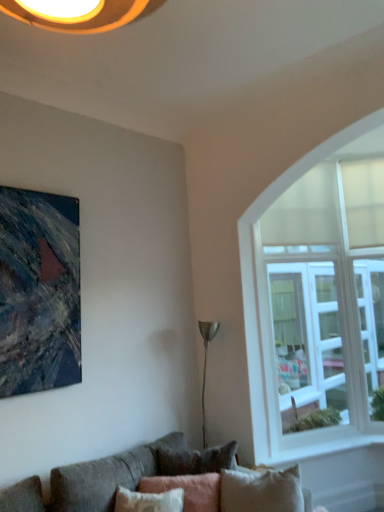
You are a GUI agent. You are given a task and a screenshot of the screen. Output one action in this format:
    pyautogui.click(x=<x>, y=<y>)
    Task: Click on the textured canvas painting at upper left
    Image resolution: width=384 pixels, height=512 pixels.
    Given the screenshot: What is the action you would take?
    pyautogui.click(x=39, y=292)

From the image's perspective, between white glass window at right and textured gray couch at lower left, which one is located above?

white glass window at right, from the image's perspective.

Is white glass window at right inside the boundaries of textured gray couch at lower left, or outside?

white glass window at right is not enclosed by textured gray couch at lower left.

Consider the image. Between white glass window at right and textured gray couch at lower left, which one appears on the right side from the viewer's perspective?

Positioned to the right is white glass window at right.

Looking at this image, is white glass window at right behind textured gray couch at lower left?

That is True.

From a real-world perspective, is textured gray couch at lower left physically located above or below pink fabric pillow at lower center?

From a real-world perspective, textured gray couch at lower left is physically below pink fabric pillow at lower center.

Does point (196, 456) lie in front of point (169, 488)?

No, it is not.

Considering the relative sizes of textured gray couch at lower left and pink fabric pillow at lower center in the image provided, is textured gray couch at lower left taller than pink fabric pillow at lower center?

Correct, textured gray couch at lower left is much taller as pink fabric pillow at lower center.

Considering their positions, is textured gray couch at lower left located in front of or behind pink fabric pillow at lower center?

textured gray couch at lower left is positioned closer to the viewer than pink fabric pillow at lower center.

From the image's perspective, is pink fabric pillow at lower center beneath white glass window at right?

Yes, from the image's perspective, pink fabric pillow at lower center is below white glass window at right.

Is pink fabric pillow at lower center taller than white glass window at right?

Incorrect, the height of pink fabric pillow at lower center is not larger of that of white glass window at right.

Is pink fabric pillow at lower center wider or thinner than white glass window at right?

In the image, pink fabric pillow at lower center appears to be wider than white glass window at right.

Is pink fabric pillow at lower center spatially inside white glass window at right, or outside of it?

pink fabric pillow at lower center cannot be found inside white glass window at right.

Is textured canvas painting at upper left far from pink fabric pillow at lower center?

Yes, textured canvas painting at upper left and pink fabric pillow at lower center are located far from each other.

From the image's perspective, is textured canvas painting at upper left beneath pink fabric pillow at lower center?

Incorrect, from the image's perspective, textured canvas painting at upper left is higher than pink fabric pillow at lower center.

Is textured canvas painting at upper left positioned behind pink fabric pillow at lower center?

Yes, it is behind pink fabric pillow at lower center.

Which is behind, point (257, 293) or point (208, 476)?

The point (257, 293) is more distant.

Is white glass window at right positioned with its back to pink fabric pillow at lower center?

white glass window at right is not turned away from pink fabric pillow at lower center.

Which object is more forward, white glass window at right or pink fabric pillow at lower center?

pink fabric pillow at lower center is closer to the camera.

From the image's perspective, relative to pink fabric pillow at lower center, is white glass window at right above or below?

Based on their image positions, white glass window at right is located above pink fabric pillow at lower center.

Is textured canvas painting at upper left closer to the viewer compared to textured gray couch at lower left?

No, textured canvas painting at upper left is behind textured gray couch at lower left.

Between textured canvas painting at upper left and textured gray couch at lower left, which one has smaller size?

textured canvas painting at upper left.

Considering the positions of objects pink fabric pillow at lower center and textured canvas painting at upper left in the image provided, who is more to the right, pink fabric pillow at lower center or textured canvas painting at upper left?

pink fabric pillow at lower center is more to the right.

Is textured canvas painting at upper left surrounded by pink fabric pillow at lower center?

No, pink fabric pillow at lower center does not contain textured canvas painting at upper left.

From the image's perspective, is pink fabric pillow at lower center under textured canvas painting at upper left?

Correct, pink fabric pillow at lower center appears lower than textured canvas painting at upper left in the image.

From a real-world perspective, who is located higher, pink fabric pillow at lower center or textured canvas painting at upper left?

textured canvas painting at upper left, from a real-world perspective.

This screenshot has height=512, width=384. I want to click on studio couch in front of the white glass window at right, so click(x=110, y=477).

Locate an element on the screen. pillow to the left of textured gray couch at lower left is located at coordinates (188, 490).

From the image, which object appears to be farther from white glass window at right, textured canvas painting at upper left or pink fabric pillow at lower center?

The object further to white glass window at right is textured canvas painting at upper left.

Considering their positions, is textured canvas painting at upper left positioned further to white glass window at right than textured gray couch at lower left?

Based on the image, textured canvas painting at upper left appears to be further to white glass window at right.

Estimate the real-world distances between objects in this image. Which object is further from white glass window at right, pink fabric pillow at lower center or textured canvas painting at upper left?

The object further to white glass window at right is textured canvas painting at upper left.

Looking at the image, which one is located closer to textured canvas painting at upper left, pink fabric pillow at lower center or white glass window at right?

Based on the image, pink fabric pillow at lower center appears to be nearer to textured canvas painting at upper left.

From the image, which object appears to be nearer to white glass window at right, pink fabric pillow at lower center or textured gray couch at lower left?

pink fabric pillow at lower center.

Estimate the real-world distances between objects in this image. Which object is closer to pink fabric pillow at lower center, white glass window at right or textured canvas painting at upper left?

white glass window at right is positioned closer to the anchor pink fabric pillow at lower center.

Considering their positions, is textured gray couch at lower left positioned further to pink fabric pillow at lower center than textured canvas painting at upper left?

textured canvas painting at upper left is positioned further to the anchor pink fabric pillow at lower center.

Considering their positions, is textured canvas painting at upper left positioned closer to textured gray couch at lower left than pink fabric pillow at lower center?

pink fabric pillow at lower center.

Where is `pillow that lies between textured canvas painting at upper left and textured gray couch at lower left from top to bottom`? The height and width of the screenshot is (512, 384). pillow that lies between textured canvas painting at upper left and textured gray couch at lower left from top to bottom is located at coordinates (188, 490).

Locate an element on the screen. The height and width of the screenshot is (512, 384). pillow between textured canvas painting at upper left and white glass window at right is located at coordinates (188, 490).

You are a GUI agent. You are given a task and a screenshot of the screen. Output one action in this format:
    pyautogui.click(x=<x>, y=<y>)
    Task: Click on the picture frame located between textured gray couch at lower left and white glass window at right in the depth direction
    The height and width of the screenshot is (512, 384).
    Given the screenshot: What is the action you would take?
    pyautogui.click(x=39, y=292)

The height and width of the screenshot is (512, 384). I want to click on pillow located between textured gray couch at lower left and white glass window at right in the depth direction, so click(x=188, y=490).